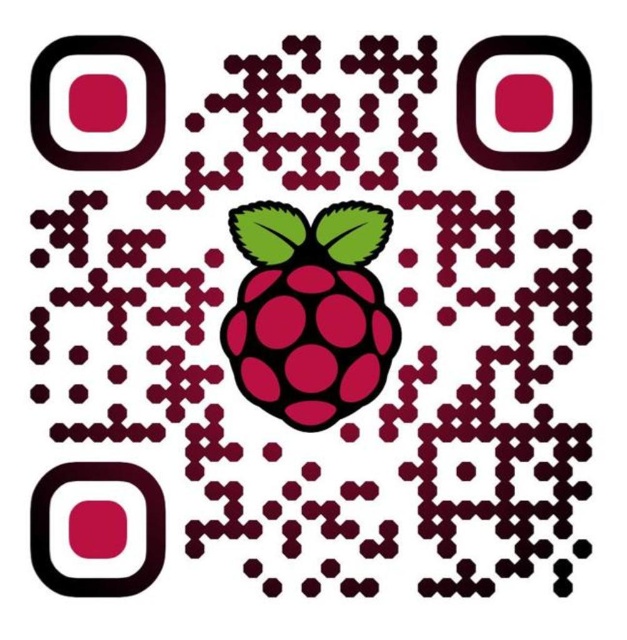
You are designing a new QR code and want to ensure symmetry between the matte black square at upper left and the matte black square at upper right. Based on the provided image, which square has a smaller width?

The matte black square at upper left has a smaller width than the matte black square at upper right according to the description.

You are designing a new QR code and need to place a matte black square at upper left. According to the existing design, where should you place it in terms of coordinates?

The matte black square at upper left should be placed at coordinates point (145, 102).

You are holding a smartphone camera and want to scan the QR code shown in the image. The QR code has a specific point located at coordinates point (x=362, y=259). If the distance between this point and your camera is 19.47 inches, is the smartphone positioned close enough to scan the QR code effectively?

The point (x=362, y=259) is 19.47 inches away from the camera. Since QR codes typically require the camera to be within a reasonable distance for clear scanning, 19.47 inches is likely close enough for effective scanning unless the QR code is very small or the lighting is poor.